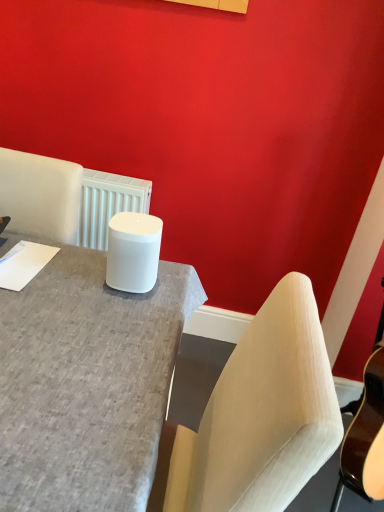
Question: Would you say white matte cylinder at center contains matte gray desk at center?

Choices:
 (A) no
 (B) yes

Answer: (A)

Question: Considering the relative positions of white matte cylinder at center and matte gray desk at center in the image provided, is white matte cylinder at center to the left of matte gray desk at center from the viewer's perspective?

Choices:
 (A) no
 (B) yes

Answer: (B)

Question: Can we say white matte cylinder at center lies outside matte gray desk at center?

Choices:
 (A) yes
 (B) no

Answer: (A)

Question: From the image's perspective, does white matte cylinder at center appear higher than matte gray desk at center?

Choices:
 (A) yes
 (B) no

Answer: (A)

Question: Can you confirm if white matte cylinder at center is wider than matte gray desk at center?

Choices:
 (A) yes
 (B) no

Answer: (B)

Question: Does white matte cylinder at center lie behind matte gray desk at center?

Choices:
 (A) yes
 (B) no

Answer: (A)

Question: Is matte gray desk at center oriented away from white matte cylinder at center?

Choices:
 (A) yes
 (B) no

Answer: (B)

Question: Can you confirm if matte gray desk at center is thinner than white matte cylinder at center?

Choices:
 (A) yes
 (B) no

Answer: (B)

Question: Does matte gray desk at center appear on the left side of white matte cylinder at center?

Choices:
 (A) no
 (B) yes

Answer: (A)

Question: Is matte gray desk at center completely or partially outside of white matte cylinder at center?

Choices:
 (A) yes
 (B) no

Answer: (A)

Question: From the image's perspective, is matte gray desk at center under white matte cylinder at center?

Choices:
 (A) yes
 (B) no

Answer: (A)

Question: Can you confirm if matte gray desk at center is smaller than white matte cylinder at center?

Choices:
 (A) yes
 (B) no

Answer: (B)

Question: Is matte gray desk at center bigger or smaller than white matte cylinder at center?

Choices:
 (A) big
 (B) small

Answer: (A)